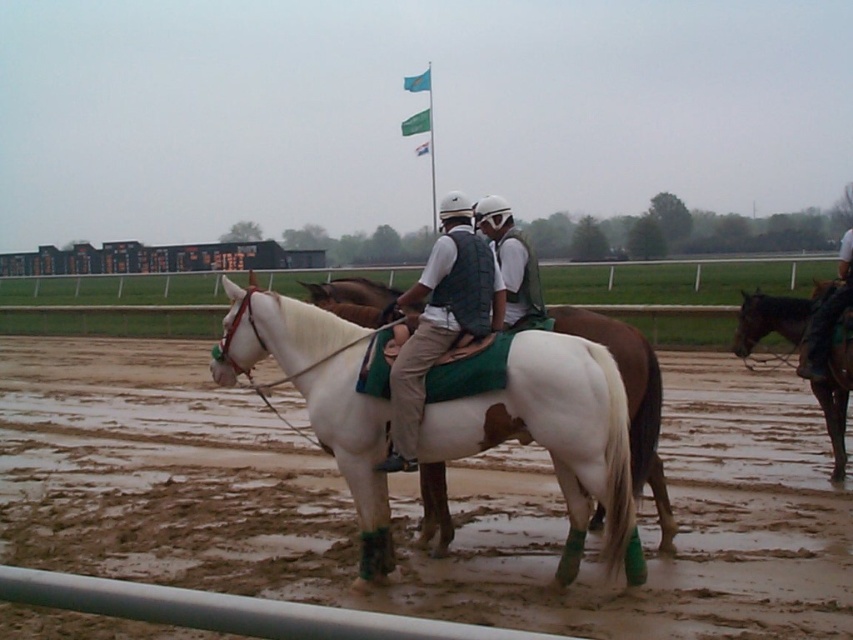
Can you confirm if brown glossy horse at right is wider than blue fabric flag at upper center?

Incorrect, brown glossy horse at right's width does not surpass blue fabric flag at upper center's.

In the scene shown: How much distance is there between brown glossy horse at right and blue fabric flag at upper center?

They are 40.50 meters apart.

Does point (747, 349) lie in front of point (405, 81)?

Yes, it is.

You are a GUI agent. You are given a task and a screenshot of the screen. Output one action in this format:
    pyautogui.click(x=<x>, y=<y>)
    Task: Click on the brown glossy horse at right
    
    Given the screenshot: What is the action you would take?
    (x=773, y=317)

Between white glossy horse at center and brown glossy horse at right, which one is positioned lower?

brown glossy horse at right is lower down.

Image resolution: width=853 pixels, height=640 pixels. What do you see at coordinates (445, 316) in the screenshot?
I see `white glossy horse at center` at bounding box center [445, 316].

Locate an element on the screen. The width and height of the screenshot is (853, 640). white glossy horse at center is located at coordinates (445, 316).

Is white matte dirt field at center to the right of brown glossy horse at right from the viewer's perspective?

Incorrect, white matte dirt field at center is not on the right side of brown glossy horse at right.

What do you see at coordinates (415, 500) in the screenshot? Image resolution: width=853 pixels, height=640 pixels. I see `white matte dirt field at center` at bounding box center [415, 500].

Locate an element on the screen. white matte dirt field at center is located at coordinates (415, 500).